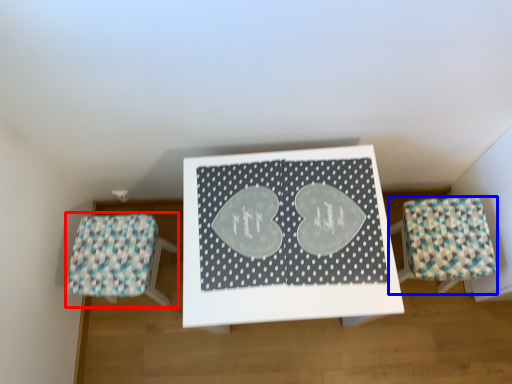
Question: Which point is closer to the camera, furniture (highlighted by a red box) or furniture (highlighted by a blue box)?

Choices:
 (A) furniture
 (B) furniture

Answer: (B)